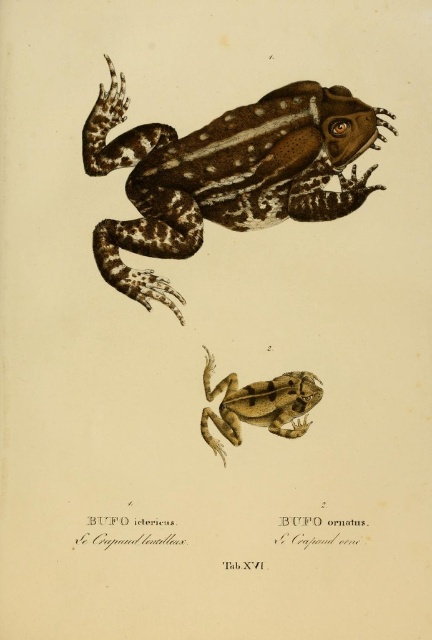
In the botanical illustration, you see a brown spotted skin frog at upper center and a brown textured frog at center. Which frog is placed higher in the image?

The brown spotted skin frog at upper center is placed higher than the brown textured frog at center.

You are an entomologist examining the illustration and need to locate the brown spotted skin frog at upper center and the brown textured frog at center. According to the illustration, which frog is positioned to the right of the other?

The brown textured frog at center is to the right of the brown spotted skin frog at upper center.

You are a biologist examining the illustration and need to identify the frog species. Based on their size, which frog is more likely to be the larger species, the brown spotted skin frog at upper center or the brown textured frog at center?

The brown spotted skin frog at upper center is larger in size than the brown textured frog at center, so it is more likely to be the larger species.